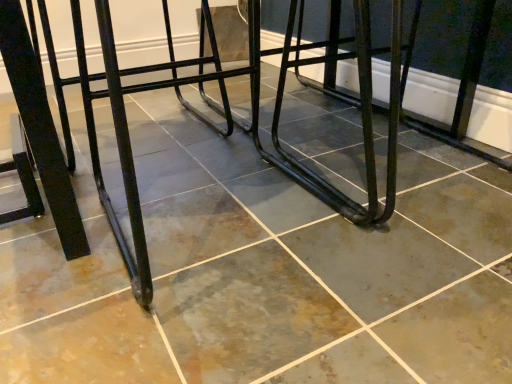
Question: Should I look upward or downward to see black metal bar stool at center?

Choices:
 (A) up
 (B) down

Answer: (A)